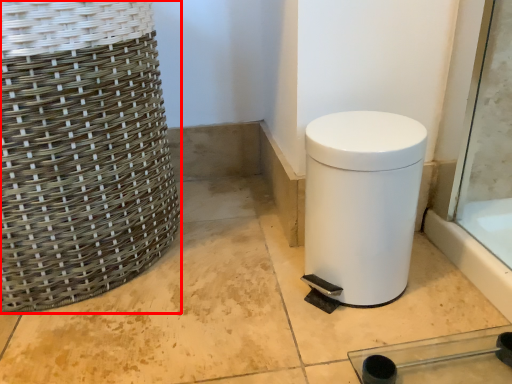
Question: From the image, what is the correct spatial relationship of basket (annotated by the red box) in relation to waste container?

Choices:
 (A) left
 (B) right

Answer: (A)